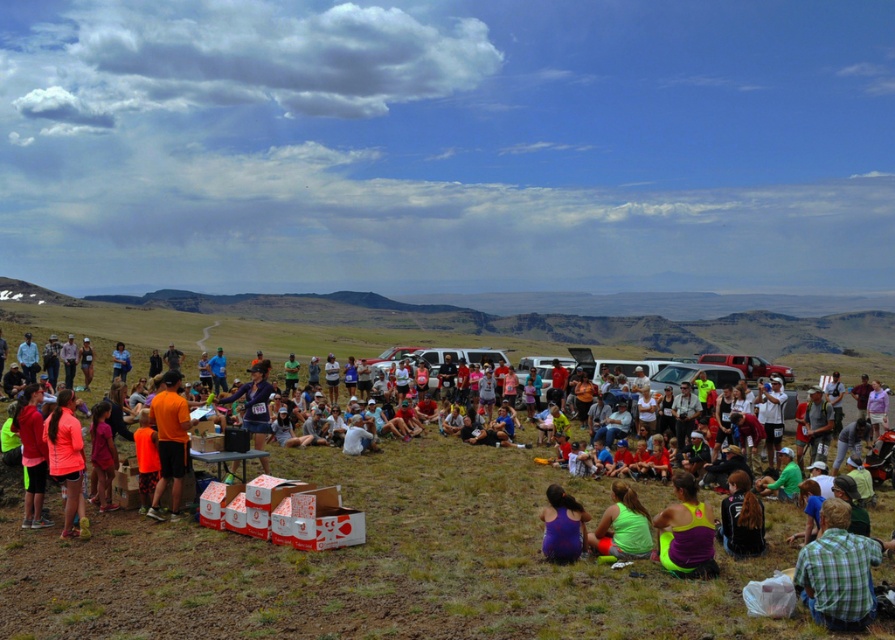
You are a photographer at the event and want to capture both the neon green tank top at lower center and the shiny purple jacket at lower right in a single frame. Given their sizes, which one might appear closer to the camera in the photo?

The neon green tank top at lower center appears larger in size than the shiny purple jacket at lower right, so it would likely be closer to the camera in the photo.

You are at the center of the gathering and see the neon pink fabric at center and the purple fabric at center. Which fabric is positioned to the left?

The neon pink fabric at center is positioned to the left of the purple fabric at center.